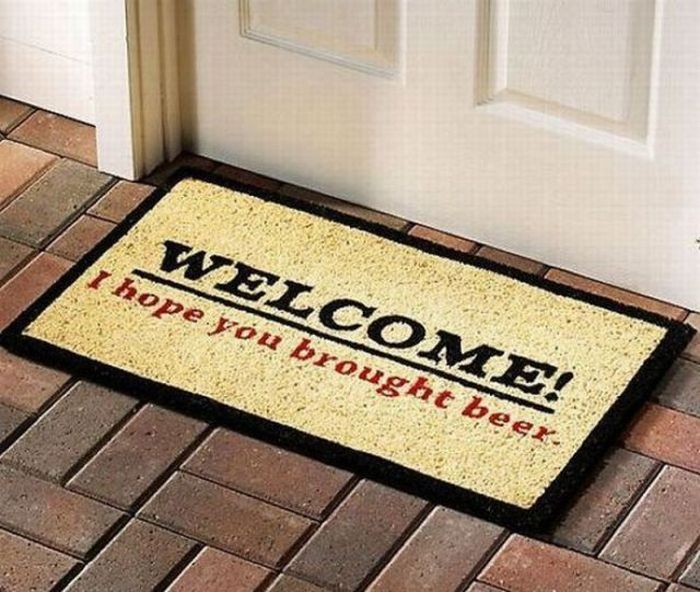
You are a GUI agent. You are given a task and a screenshot of the screen. Output one action in this format:
    pyautogui.click(x=<x>, y=<y>)
    Task: Click on the welcome mat
    The image size is (700, 592).
    Given the screenshot: What is the action you would take?
    pyautogui.click(x=318, y=400)